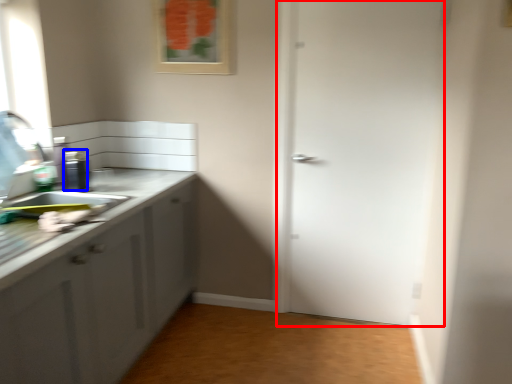
Question: Among these objects, which one is farthest to the camera, door (highlighted by a red box) or appliance (highlighted by a blue box)?

Choices:
 (A) door
 (B) appliance

Answer: (A)